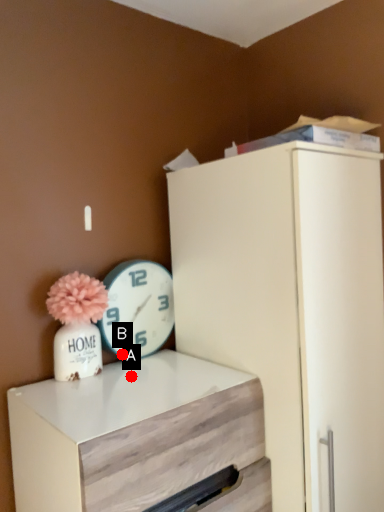
Question: Two points are circled on the image, labeled by A and B beside each circle. Among these points, which one is farthest from the camera?

Choices:
 (A) A is further
 (B) B is further

Answer: (B)